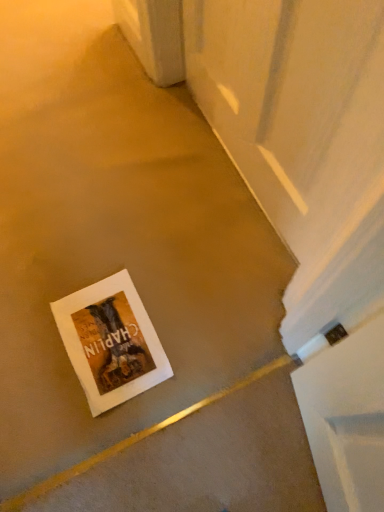
This screenshot has width=384, height=512. Find the location of `vacant space situated above white paper at lower left (from a real-world perspective)`. vacant space situated above white paper at lower left (from a real-world perspective) is located at coordinates (102, 335).